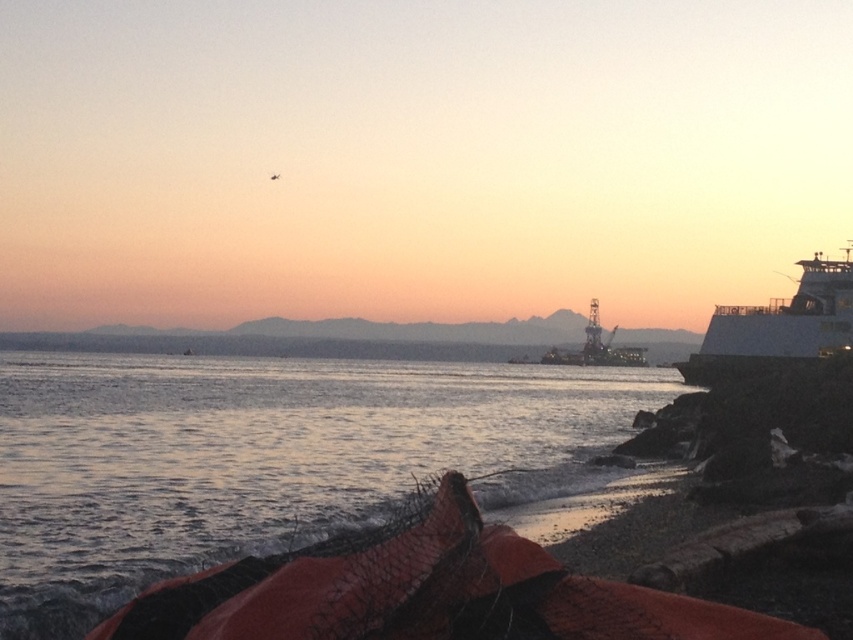
Question: Among these points, which one is farthest from the camera?

Choices:
 (A) (764, 356)
 (B) (552, 352)

Answer: (B)

Question: Can you confirm if glistening water at lower left is bigger than white matte ferry at right?

Choices:
 (A) yes
 (B) no

Answer: (A)

Question: Is the position of glistening water at lower left less distant than that of metallic gray oil rig at center?

Choices:
 (A) no
 (B) yes

Answer: (B)

Question: Which object is farther from the camera taking this photo?

Choices:
 (A) white matte ferry at right
 (B) metallic gray oil rig at center
 (C) glistening water at lower left

Answer: (B)

Question: Is glistening water at lower left bigger than metallic gray oil rig at center?

Choices:
 (A) no
 (B) yes

Answer: (B)

Question: Which object is farther from the camera taking this photo?

Choices:
 (A) metallic gray oil rig at center
 (B) white matte ferry at right

Answer: (A)